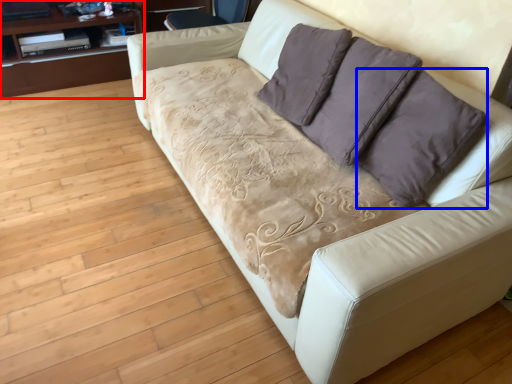
Question: Which of the following is the farthest to the observer, dresser (highlighted by a red box) or throw pillow (highlighted by a blue box)?

Choices:
 (A) dresser
 (B) throw pillow

Answer: (A)